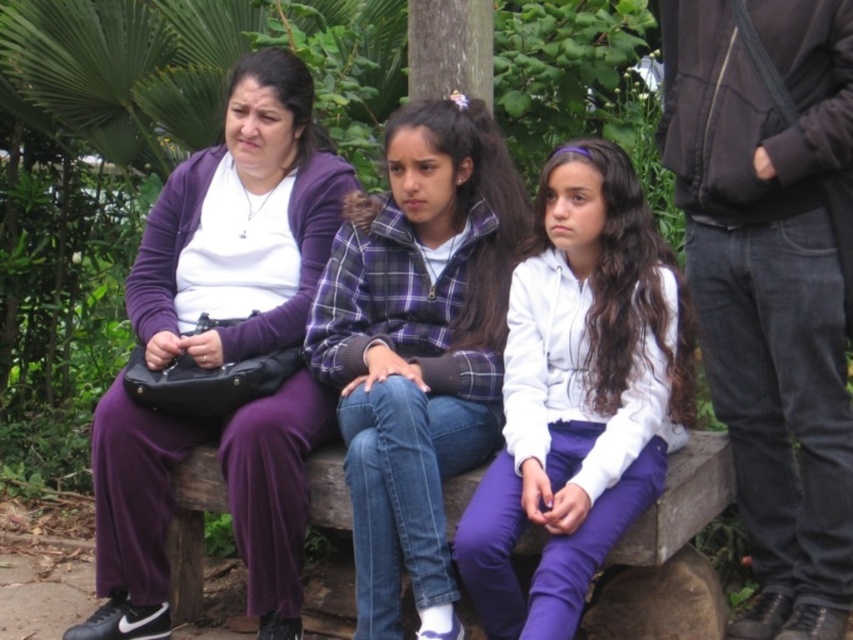
You are a tailor who needs to determine which jacket requires more fabric to make between the plaid fabric jacket at center and the white matte jacket at center. Based on the image, which one would need more material?

The plaid fabric jacket at center requires more fabric because its width is larger than the white matte jacket at center.

You are designing a new clothing line and want to ensure that the purple matte pants at left and the plaid fabric jacket at center are proportionally balanced in a catalog layout. Given their sizes, which item should be placed in a larger space to maintain visual harmony?

The purple matte pants at left are larger in size compared to the plaid fabric jacket at center, so to maintain visual harmony, the purple matte pants at left should be placed in a larger space in the catalog layout.

Consider the image. You are standing at the plaid fabric jacket at center and want to take a photo of the camera. Can you reach the camera without moving from your current position?

The plaid fabric jacket at center and camera are 3.69 meters apart from each other. Since the distance is too far to reach, you cannot grab the camera without moving.